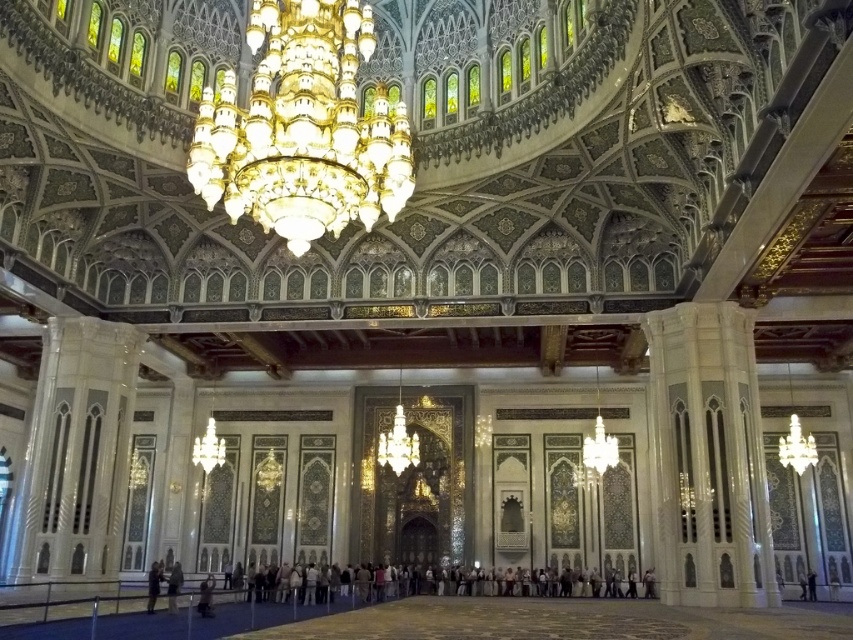
Question: In this image, where is gold crystal chandelier at upper center located relative to dark blue jeans at lower center?

Choices:
 (A) left
 (B) right

Answer: (B)

Question: Can you confirm if gold crystal chandelier at upper center is positioned to the left of dark blue jeans at lower center?

Choices:
 (A) yes
 (B) no

Answer: (B)

Question: Which object appears farthest from the camera in this image?

Choices:
 (A) dark blue jeans at lower center
 (B) gold crystal chandelier at upper center

Answer: (A)

Question: Can you confirm if gold crystal chandelier at upper center is thinner than dark blue jeans at lower center?

Choices:
 (A) yes
 (B) no

Answer: (B)